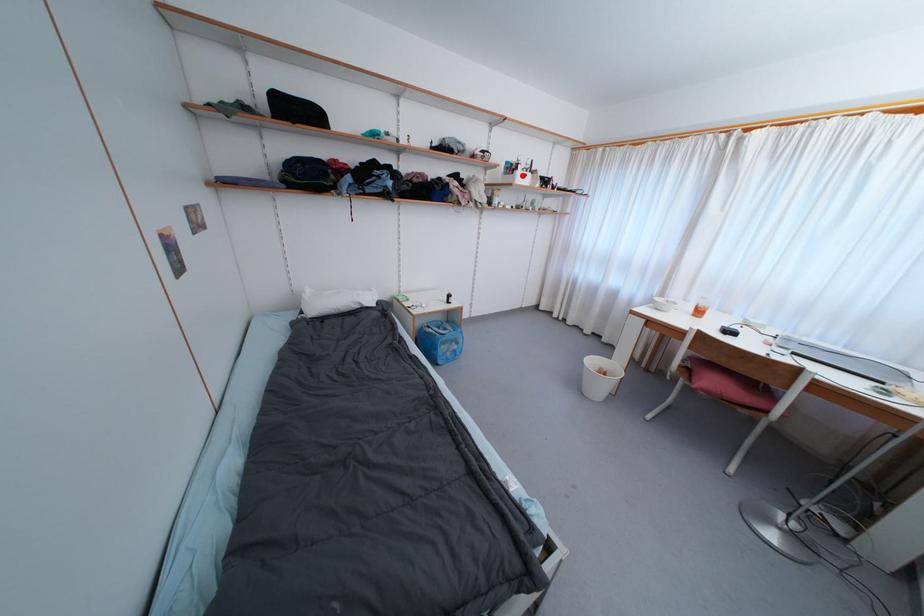
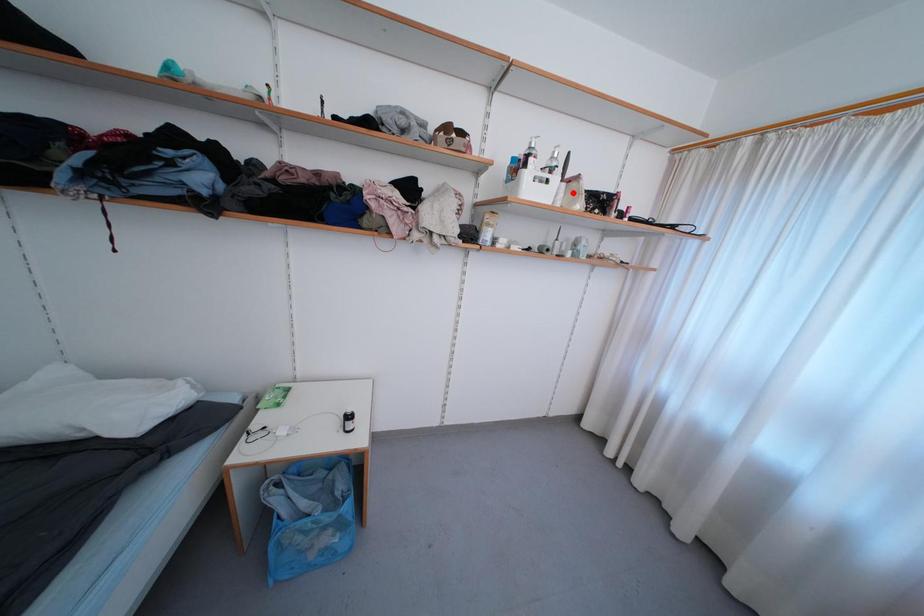
Looking at this image, I am providing you with two images of the same scene from different viewpoints. A red point is marked on the first image and another point is marked on the second image. Are the points marked in image1 and image2 representing the same 3D position?

No